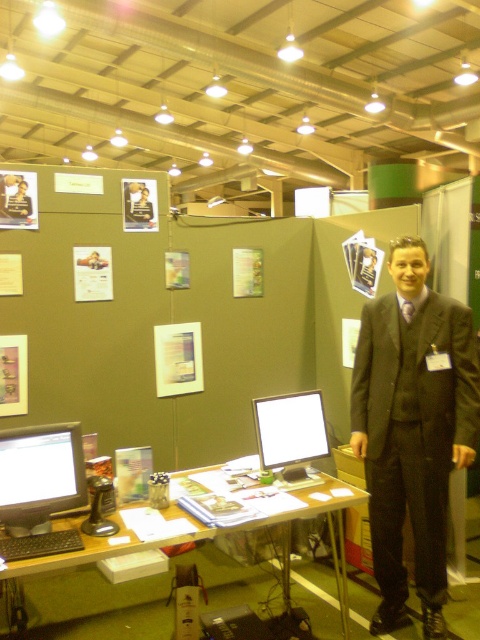
You are a photographer standing in the exhibition hall and need to take a photo of the dark gray suit at center and the wooden desk at center. Which object should you focus on first if you want to capture both in a single frame without moving the camera?

The dark gray suit at center is taller than the wooden desk at center, so you should focus on the dark gray suit at center first to ensure it is in frame with the wooden desk at center.

You are at the exhibition hall and need to locate the matte black monitor at left. According to the coordinates provided, where exactly is it positioned in the booth?

The matte black monitor at left is located at point (39,476).

Consider the image. You are setting up a presentation and need to adjust the position of the matte black monitor at left and the wooden desk at center. Based on their current positions, which object is higher in elevation?

The matte black monitor at left is above the wooden desk at center, so it is higher in elevation.